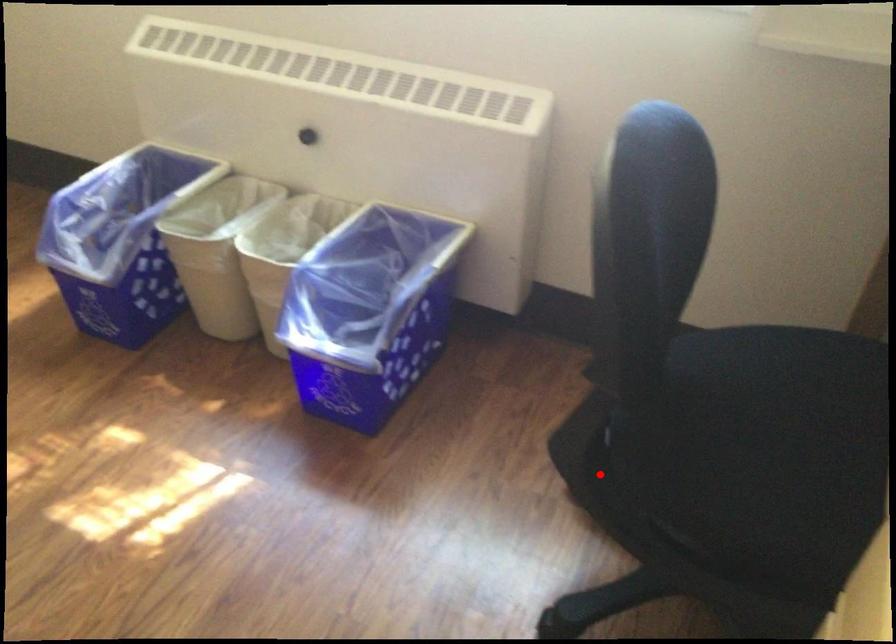
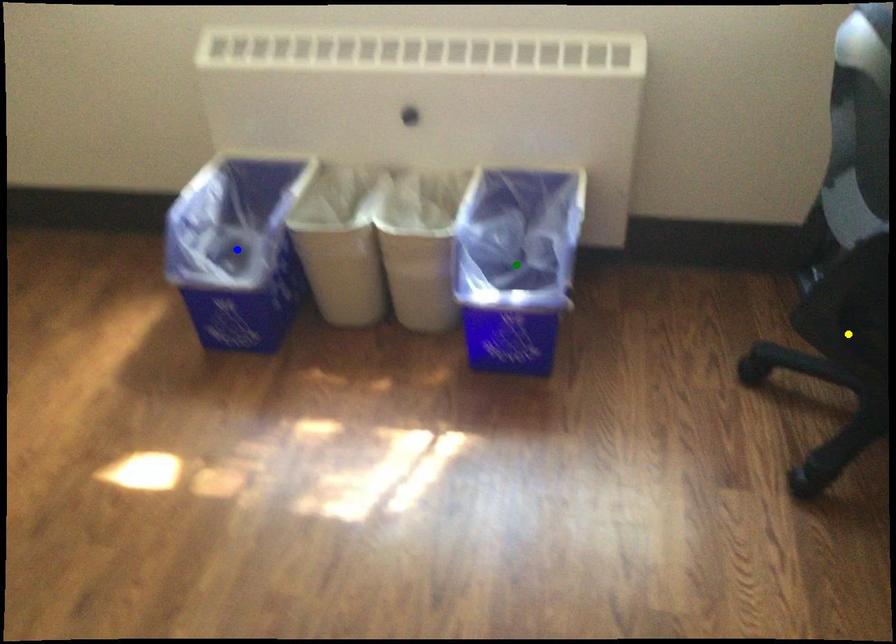
Question: I am providing you with two images of the same scene from different viewpoints. A red point is marked on the first image. You are given multiple points on the second image. Which spot in image 2 lines up with the point in image 1?

Choices:
 (A) yellow point
 (B) blue point
 (C) green point

Answer: (A)